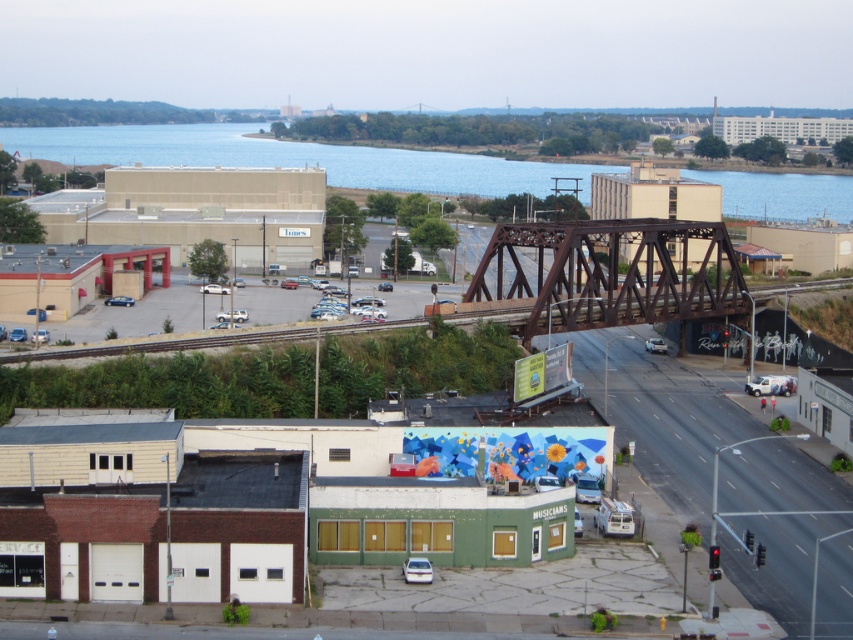
Is brown metal train track at center closer to the viewer compared to silver metallic sedan at center?

Yes, it is in front of silver metallic sedan at center.

Is brown metal train track at center shorter than silver metallic sedan at center?

No.

Between point (833, 284) and point (665, 346), which one is positioned in front?

Point (665, 346) is more forward.

This screenshot has height=640, width=853. I want to click on brown metal train track at center, so (x=166, y=342).

Does point (204, 288) lie in front of point (579, 529)?

No, it is behind (579, 529).

In the scene shown: Is white matte sedan at center further to the viewer compared to metallic silver sedan at center?

Yes, it is.

Between point (223, 289) and point (576, 525), which one is positioned in front?

Positioned in front is point (576, 525).

Where is `white matte sedan at center`? white matte sedan at center is located at coordinates (213, 289).

Does point (270, 330) come in front of point (579, 532)?

That is False.

At what (x,y) coordinates should I click in order to perform the action: click on brown metal train track at center. Please return your answer as a coordinate pair (x, y). The image size is (853, 640). Looking at the image, I should click on (166, 342).

Does point (751, 288) come farther from viewer compared to point (573, 524)?

Yes, point (751, 288) is behind point (573, 524).

This screenshot has width=853, height=640. In order to click on brown metal train track at center in this screenshot , I will do `click(166, 342)`.